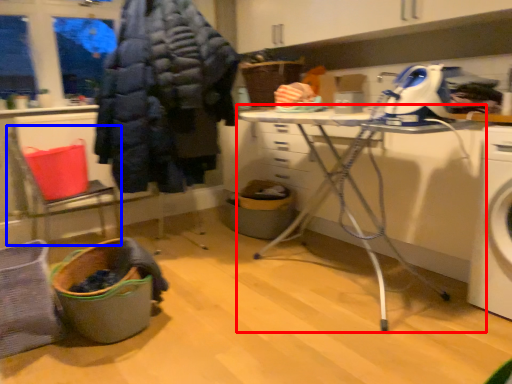
Question: Which of the following is the farthest to the observer, table (highlighted by a red box) or chair (highlighted by a blue box)?

Choices:
 (A) table
 (B) chair

Answer: (B)